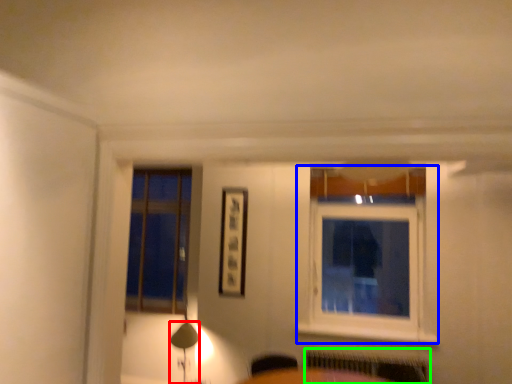
Question: Which object is positioned farthest from table lamp (highlighted by a red box)? Select from window (highlighted by a blue box) and radiator (highlighted by a green box).

Choices:
 (A) window
 (B) radiator

Answer: (A)